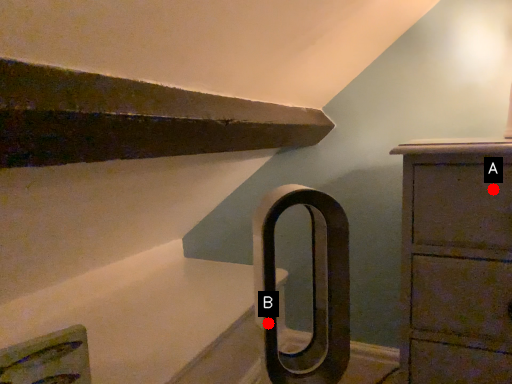
Question: Two points are circled on the image, labeled by A and B beside each circle. Among these points, which one is nearest to the camera?

Choices:
 (A) A is closer
 (B) B is closer

Answer: (A)